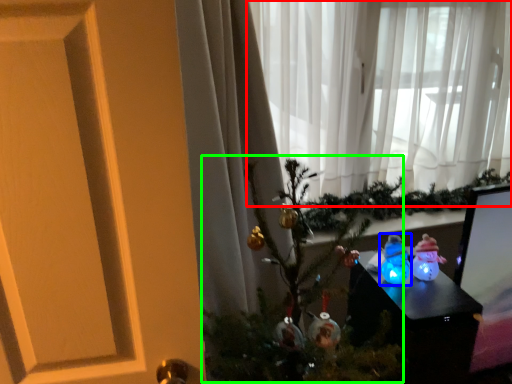
Question: Based on their relative distances, which object is nearer to curtain (highlighted by a red box)? Choose from toy (highlighted by a blue box) and christmas tree (highlighted by a green box).

Choices:
 (A) toy
 (B) christmas tree

Answer: (B)